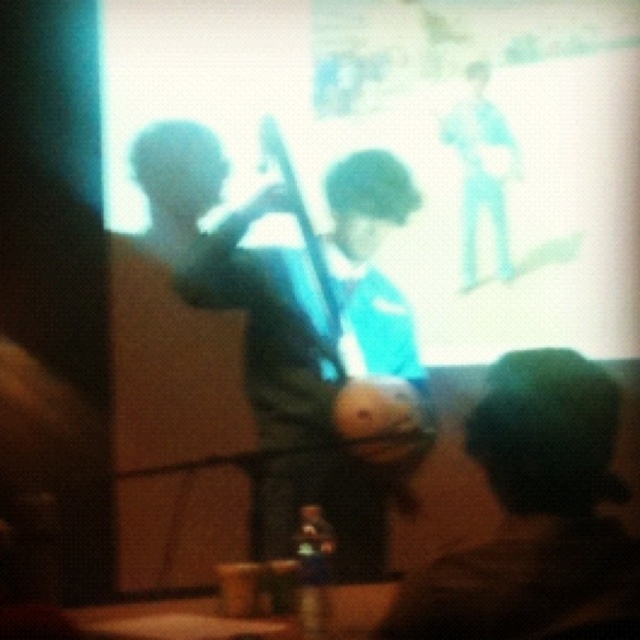
You are a presenter who needs to adjust the position of your green fuzzy hat at lower right so that it is exactly 2 meters away from the white glossy projection screen at upper center. Given that it is currently 1.64 meters away, how much further should you move it?

The green fuzzy hat at lower right is currently 1.64 meters away from the white glossy projection screen at upper center. To reach the desired distance of 2 meters, you need to move it an additional 0.36 meters further away.

You are standing in the front of the classroom and want to adjust the white glossy projection screen at upper center. Considering your height and arm reach, which is 1.95 meters, can you comfortably reach the screen to make adjustments without needing a stool?

The white glossy projection screen at upper center is 2.70 meters away from the viewer. Since your total reach is 1.95 meters, you cannot comfortably reach the screen without a stool as the distance exceeds your reach capability.